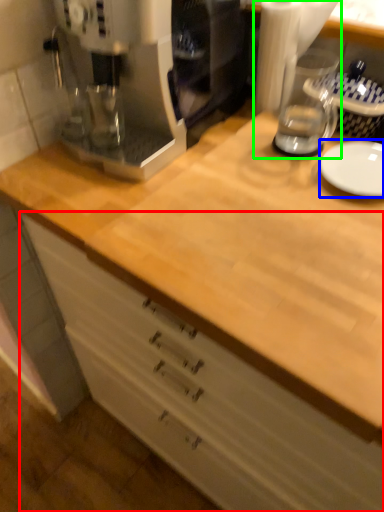
Question: Considering the real-world distances, which object is farthest from cabinetry (highlighted by a red box)? plate (highlighted by a blue box) or blender (highlighted by a green box)?

Choices:
 (A) plate
 (B) blender

Answer: (B)